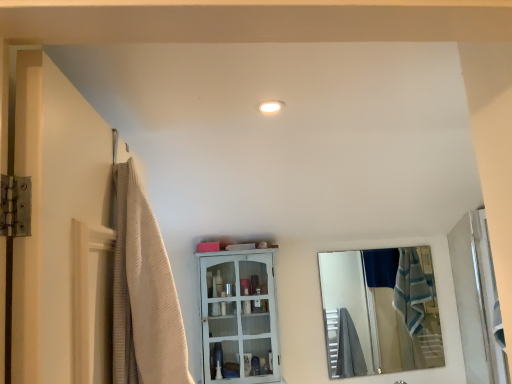
Question: Would you consider beige textured shower curtain at left to be distant from white glossy light fixture at upper center?

Choices:
 (A) no
 (B) yes

Answer: (A)

Question: Considering the relative sizes of beige textured shower curtain at left and white glossy light fixture at upper center in the image provided, is beige textured shower curtain at left taller than white glossy light fixture at upper center?

Choices:
 (A) no
 (B) yes

Answer: (B)

Question: Is beige textured shower curtain at left positioned with its back to white glossy light fixture at upper center?

Choices:
 (A) no
 (B) yes

Answer: (A)

Question: Considering the relative sizes of beige textured shower curtain at left and white glossy light fixture at upper center in the image provided, is beige textured shower curtain at left thinner than white glossy light fixture at upper center?

Choices:
 (A) yes
 (B) no

Answer: (B)

Question: Does beige textured shower curtain at left have a smaller size compared to white glossy light fixture at upper center?

Choices:
 (A) no
 (B) yes

Answer: (A)

Question: In the image, is white painted wood cabinet at center positioned in front of or behind silver reflective mirror at right?

Choices:
 (A) behind
 (B) front

Answer: (B)

Question: Based on their positions, is white painted wood cabinet at center located to the left or right of silver reflective mirror at right?

Choices:
 (A) left
 (B) right

Answer: (A)

Question: In terms of width, does white painted wood cabinet at center look wider or thinner when compared to silver reflective mirror at right?

Choices:
 (A) wide
 (B) thin

Answer: (A)

Question: Considering the positions of white painted wood cabinet at center and silver reflective mirror at right in the image, is white painted wood cabinet at center taller or shorter than silver reflective mirror at right?

Choices:
 (A) tall
 (B) short

Answer: (B)

Question: Visually, is beige textured shower curtain at left positioned to the left or to the right of white glossy door at right?

Choices:
 (A) right
 (B) left

Answer: (B)

Question: From their relative heights in the image, would you say beige textured shower curtain at left is taller or shorter than white glossy door at right?

Choices:
 (A) short
 (B) tall

Answer: (A)

Question: Is beige textured shower curtain at left wider or thinner than white glossy door at right?

Choices:
 (A) thin
 (B) wide

Answer: (A)

Question: Considering their positions, is beige textured shower curtain at left located in front of or behind white glossy door at right?

Choices:
 (A) front
 (B) behind

Answer: (A)

Question: Considering the positions of white painted wood cabinet at center and beige textured shower curtain at left in the image, is white painted wood cabinet at center bigger or smaller than beige textured shower curtain at left?

Choices:
 (A) small
 (B) big

Answer: (B)

Question: Which is correct: white painted wood cabinet at center is inside beige textured shower curtain at left, or outside of it?

Choices:
 (A) outside
 (B) inside

Answer: (A)